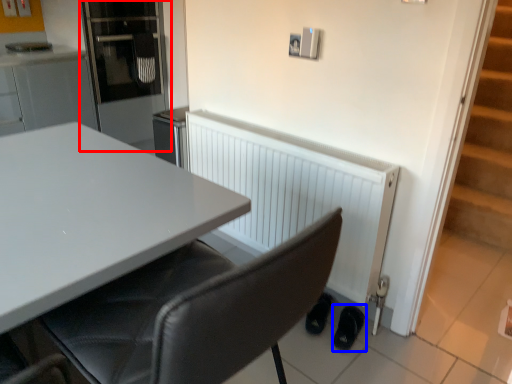
Question: Which of the following is the closest to the observer, appliance (highlighted by a red box) or footwear (highlighted by a blue box)?

Choices:
 (A) appliance
 (B) footwear

Answer: (B)